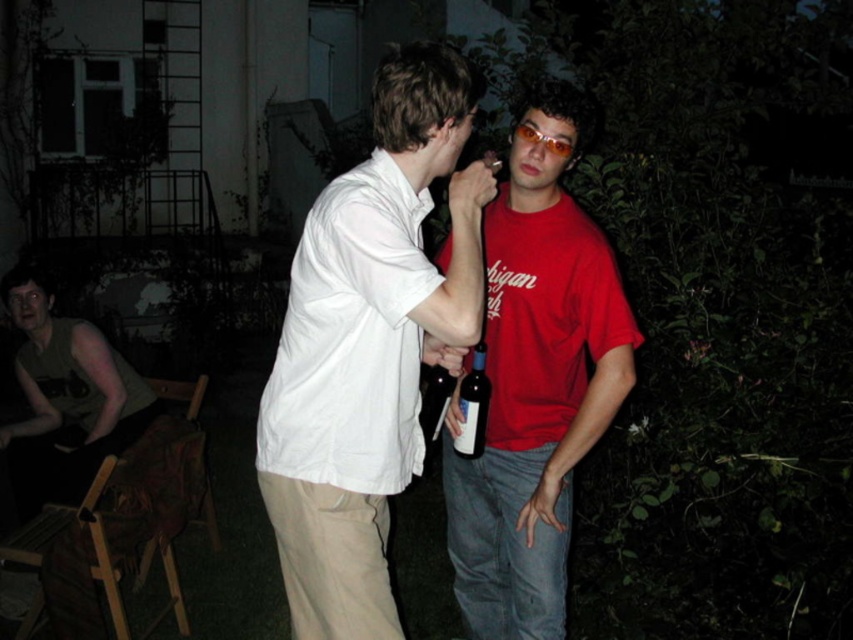
You are a photographer at the party and want to capture a clear shot of the dark blue glass bottle at center without the matte khaki pants at center blocking it. What should you do?

The matte khaki pants at center is positioned over dark blue glass bottle at center, so you should adjust your angle to look underneath the pants to capture the bottle without obstruction.

You are a photographer at the event and want to capture a closeup of the dark blue glass bottle at center without including the matte khaki pants at center in the frame. Is the bottle narrow enough to avoid the pants?

The matte khaki pants at center might be wider than dark blue glass bottle at center, so there is a possibility that the bottle is narrow enough to avoid the pants. However, since the exact width difference is uncertain, careful framing would be needed to ensure the pants are not included.